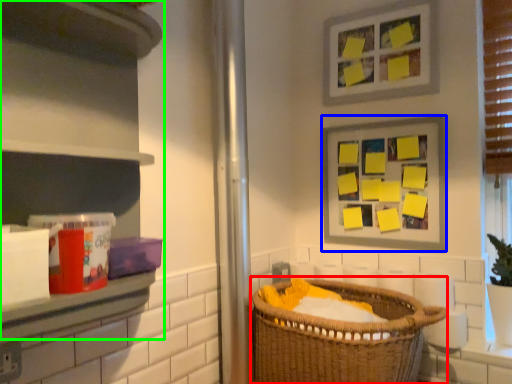
Question: Which object is the farthest from basket (highlighted by a red box)? Choose among these: picture frame (highlighted by a blue box) or cabinet (highlighted by a green box).

Choices:
 (A) picture frame
 (B) cabinet

Answer: (B)